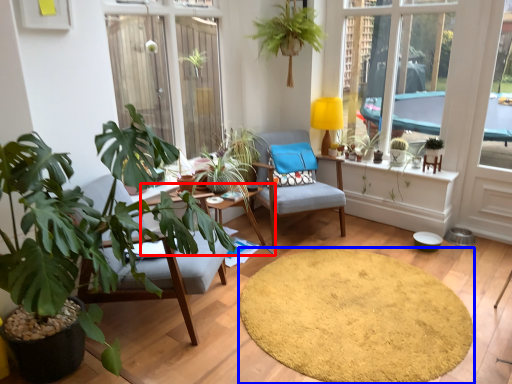
Question: Among these objects, which one is farthest to the camera, table (highlighted by a red box) or mat (highlighted by a blue box)?

Choices:
 (A) table
 (B) mat

Answer: (A)